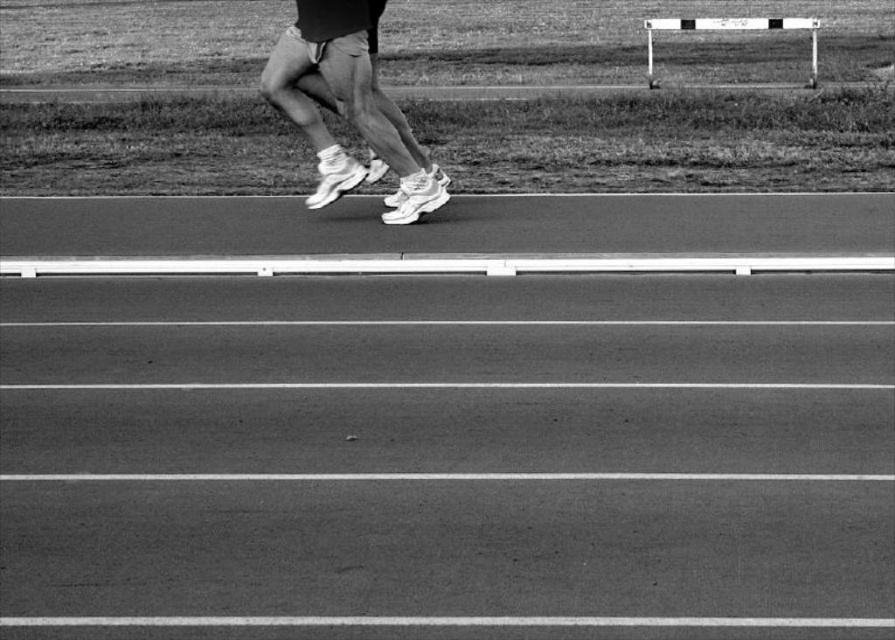
Measure the distance from smooth asphalt track at center to white mesh sneakers at center.

smooth asphalt track at center and white mesh sneakers at center are 3.71 meters apart from each other.

Which of these two, smooth asphalt track at center or white mesh sneakers at center, stands taller?

Standing taller between the two is white mesh sneakers at center.

Is point (399, 532) positioned after point (311, 99)?

That is False.

Find the location of `smooth asphalt track at center`. smooth asphalt track at center is located at coordinates (448, 417).

Is white mesh sneakers at center above metallic silver hurdle at upper right?

No.

From the picture: Measure the distance from white mesh sneakers at center to metallic silver hurdle at upper right.

white mesh sneakers at center and metallic silver hurdle at upper right are 14.59 meters apart.

Locate an element on the screen. The width and height of the screenshot is (895, 640). white mesh sneakers at center is located at coordinates (342, 104).

Find the location of a particular element. The image size is (895, 640). white mesh sneakers at center is located at coordinates (342, 104).

Between point (365, 362) and point (813, 20), which one is positioned in front?

Point (365, 362) is in front.

Does smooth asphalt track at center have a lesser height compared to metallic silver hurdle at upper right?

Correct, smooth asphalt track at center is not as tall as metallic silver hurdle at upper right.

This screenshot has height=640, width=895. I want to click on smooth asphalt track at center, so click(x=448, y=417).